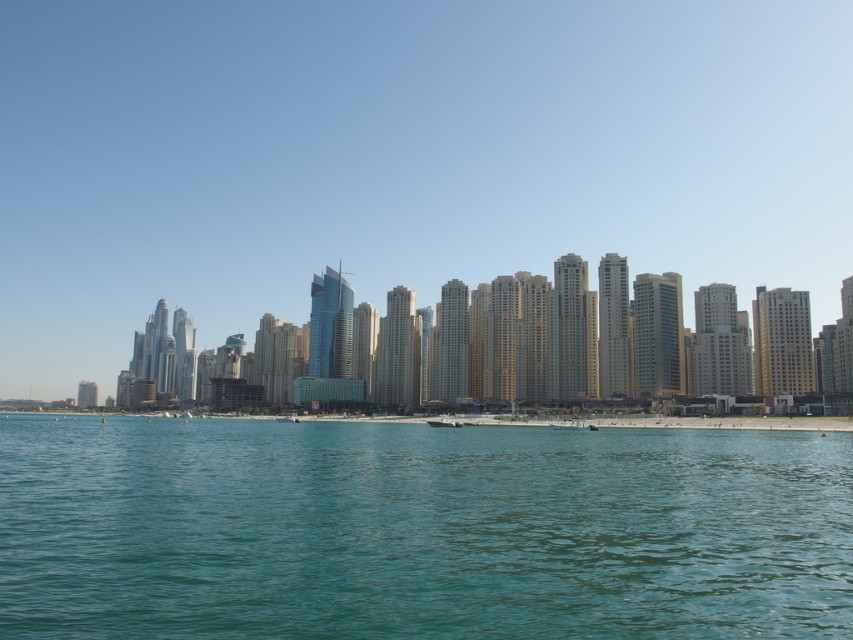
You are standing on a pier and see the clear blue water at center and the white matte boat at lower center. Which object is nearer to you?

The clear blue water at center is closer to the viewer than the white matte boat at lower center.